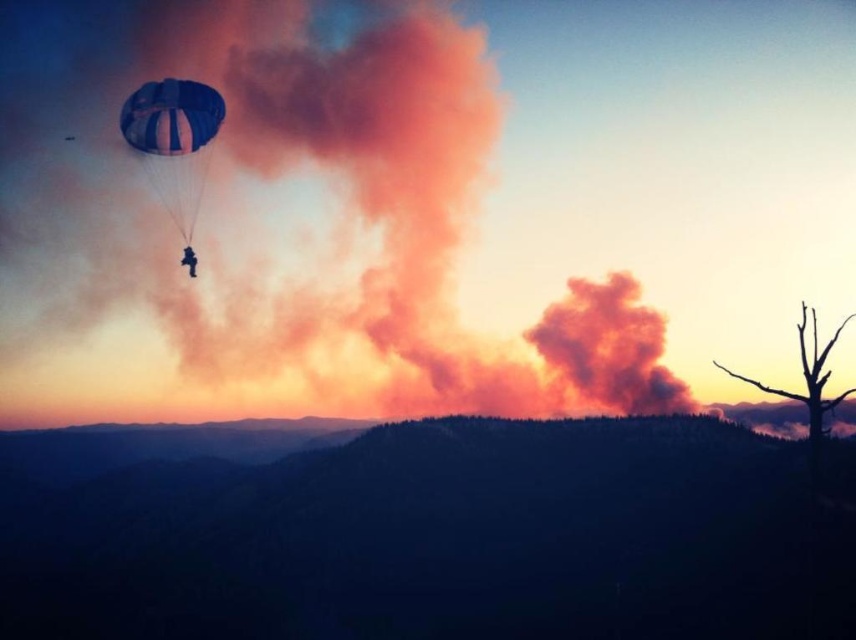
Question: Is blue striped parachute at upper left below blue fabric parachute at upper left?

Choices:
 (A) no
 (B) yes

Answer: (A)

Question: Which object is positioned closest to the blue striped parachute at upper left?

Choices:
 (A) green textured hillside at center
 (B) blue fabric parachute at upper left

Answer: (B)

Question: Can you confirm if green textured hillside at center is wider than blue fabric parachute at upper left?

Choices:
 (A) no
 (B) yes

Answer: (B)

Question: Which of the following is the farthest from the observer?

Choices:
 (A) blue striped parachute at upper left
 (B) green textured hillside at center
 (C) blue fabric parachute at upper left

Answer: (B)

Question: Does green textured hillside at center appear on the left side of blue fabric parachute at upper left?

Choices:
 (A) no
 (B) yes

Answer: (B)

Question: Which point is closer to the camera taking this photo?

Choices:
 (A) (187, 93)
 (B) (464, 440)

Answer: (A)